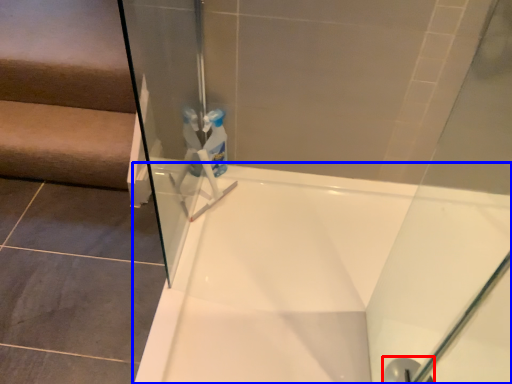
Question: Which point is further to the camera, shower (highlighted by a red box) or bathtub (highlighted by a blue box)?

Choices:
 (A) shower
 (B) bathtub

Answer: (A)